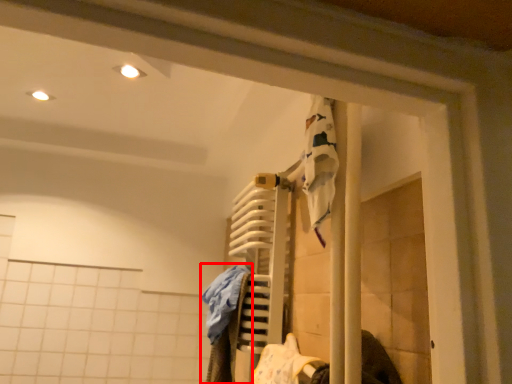
Question: From the image's perspective, where is clothing (annotated by the red box) located relative to clothing?

Choices:
 (A) above
 (B) below

Answer: (A)